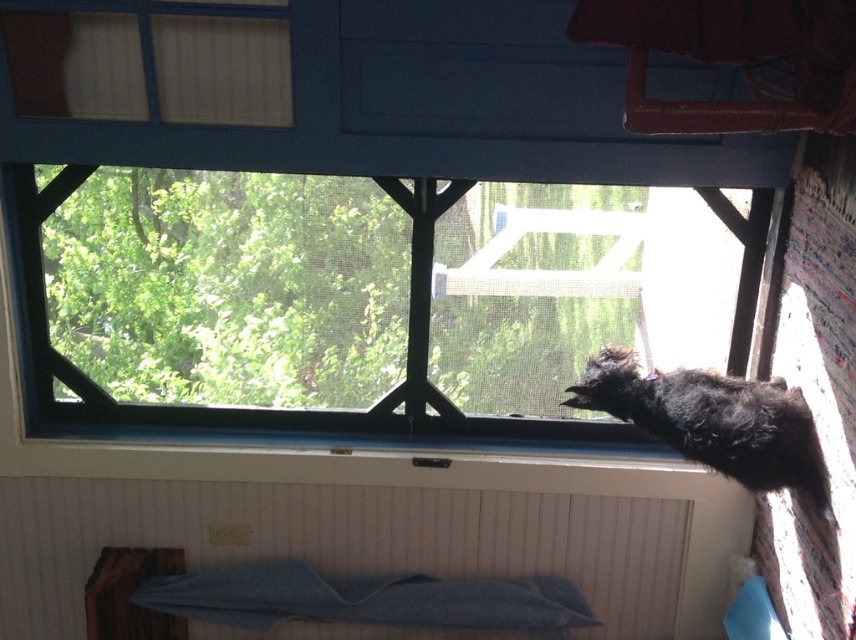
Is clear glass window at center smaller than blue painted radiator at lower left?

No, clear glass window at center is not smaller than blue painted radiator at lower left.

Does point (254, 252) come closer to viewer compared to point (391, 484)?

Yes, it is.

Locate an element on the screen. This screenshot has height=640, width=856. clear glass window at center is located at coordinates (360, 301).